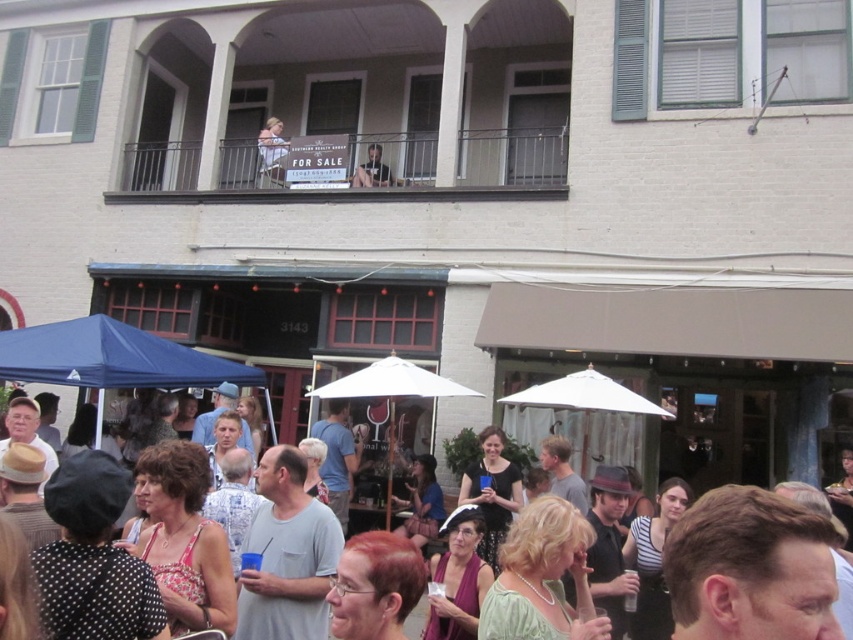
Does matte black umbrella at center lie behind dark gray shirt at upper center?

No, it is not.

Between matte black umbrella at center and dark gray shirt at upper center, which one appears on the left side from the viewer's perspective?

matte black umbrella at center is more to the left.

The image size is (853, 640). Describe the element at coordinates (27, 428) in the screenshot. I see `matte black umbrella at center` at that location.

Identify the location of matte black umbrella at center. coord(27,428).

Between matte black umbrella at center and blue fabric canopy at lower left, which one has more height?

matte black umbrella at center

Does matte black umbrella at center lie behind blue fabric canopy at lower left?

That is False.

Who is more forward, (360, 428) or (165, 387)?

Point (165, 387) is more forward.

This screenshot has height=640, width=853. I want to click on matte black umbrella at center, so click(x=27, y=428).

Does point (396, 138) lie behind point (378, 144)?

Yes, point (396, 138) is farther from viewer.

Does metallic railing at upper center have a lesser width compared to dark gray shirt at upper center?

Incorrect, metallic railing at upper center's width is not less than dark gray shirt at upper center's.

Locate an element on the screen. metallic railing at upper center is located at coordinates (354, 168).